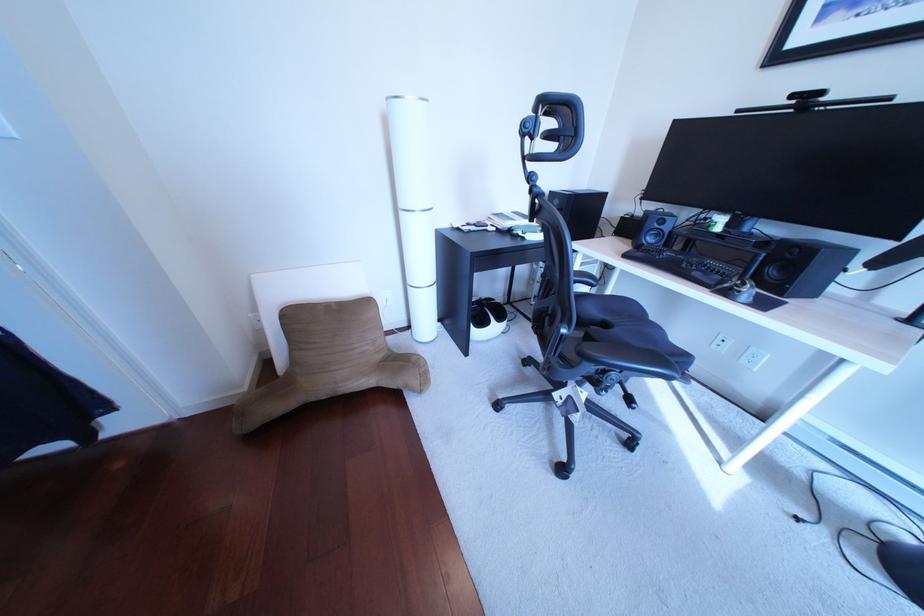
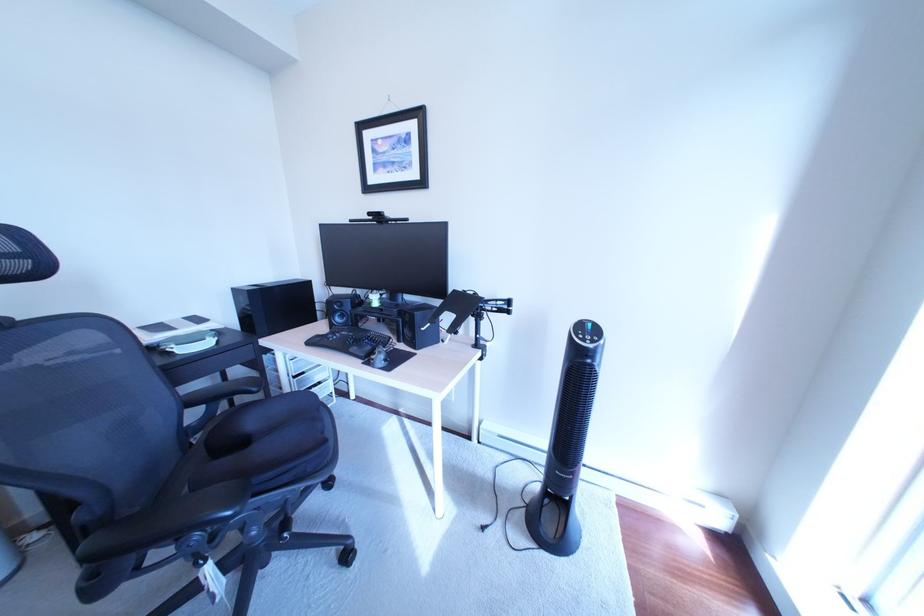
Question: The camera is either moving clockwise (left) or counter-clockwise (right) around the object. The first image is from the beginning of the video and the second image is from the end. Is the camera moving left or right when shooting the video?

Choices:
 (A) Left
 (B) Right

Answer: (A)